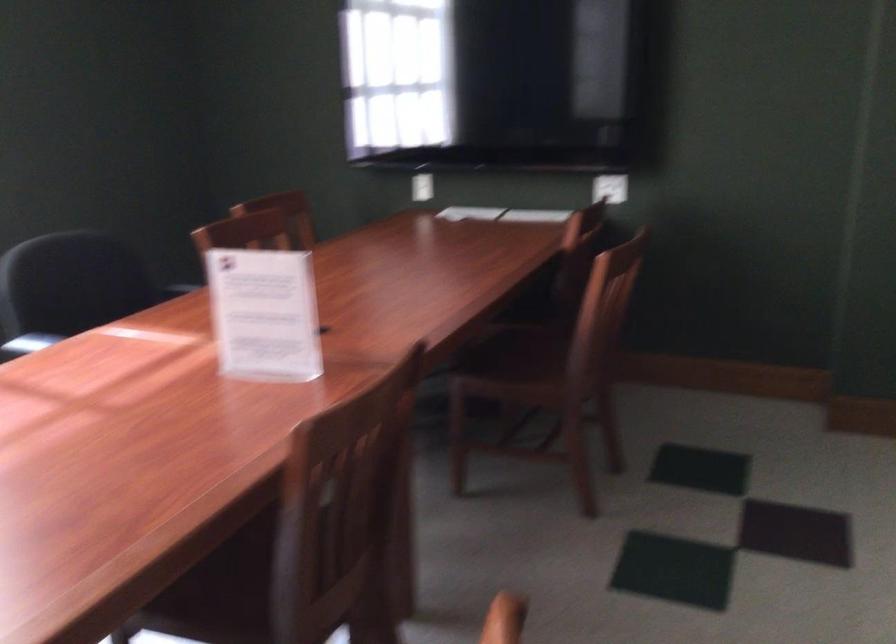
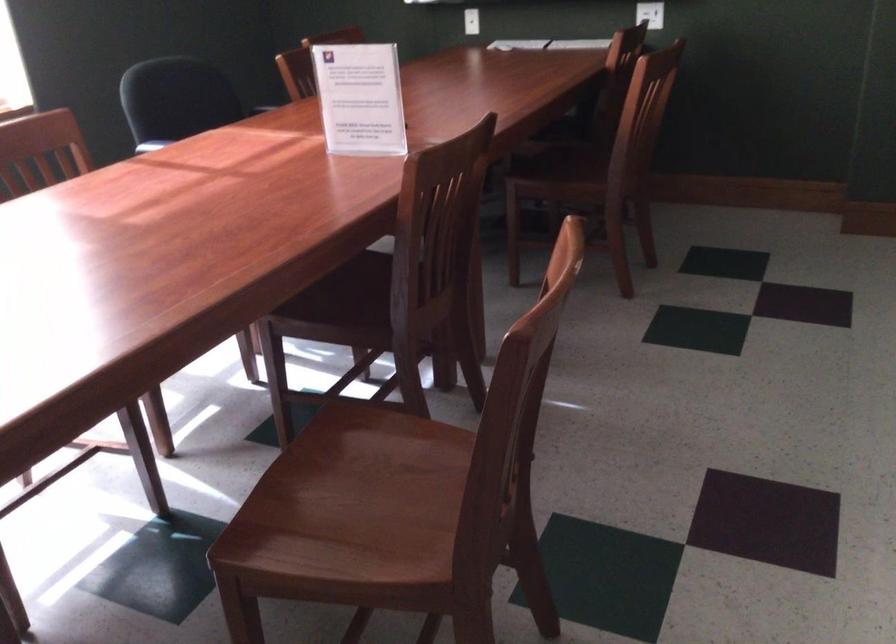
The point at (514, 353) is marked in the first image. Where is the corresponding point in the second image?

(561, 158)